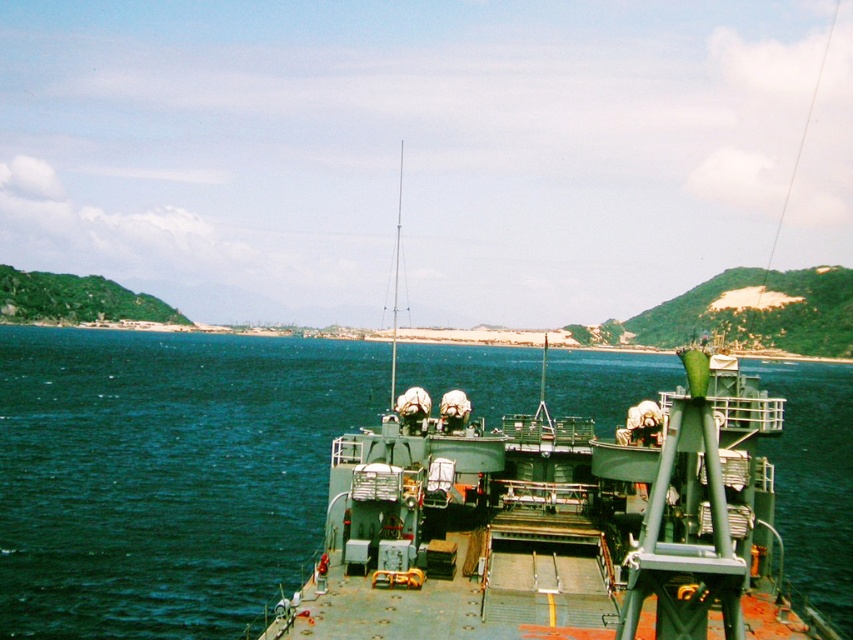
Does blue water at center have a greater height compared to green matte boat at center?

No.

Which is above, blue water at center or green matte boat at center?

green matte boat at center is higher up.

Is point (218, 371) positioned in front of point (517, 508)?

That is False.

You are a GUI agent. You are given a task and a screenshot of the screen. Output one action in this format:
    pyautogui.click(x=<x>, y=<y>)
    Task: Click on the blue water at center
    This screenshot has width=853, height=640.
    Given the screenshot: What is the action you would take?
    pyautogui.click(x=161, y=472)